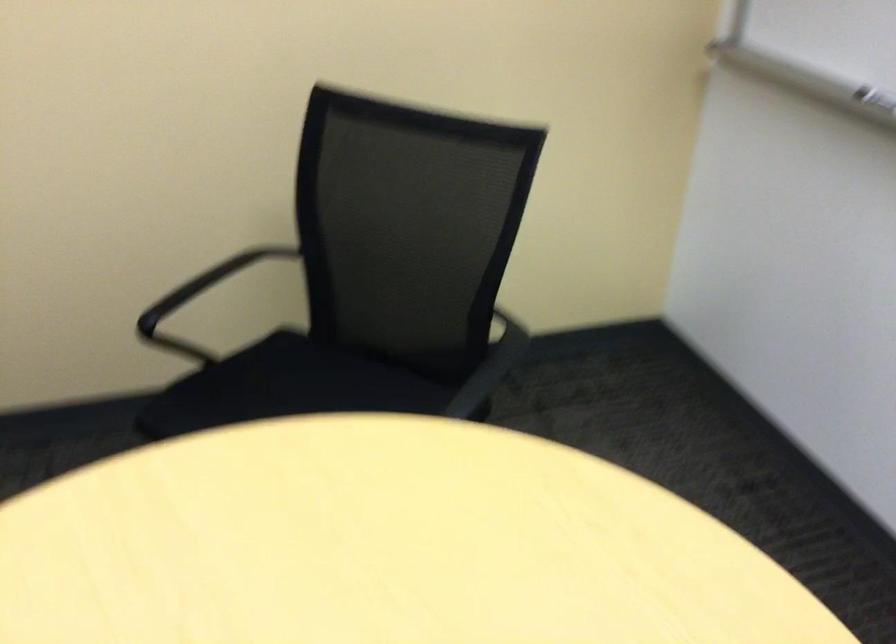
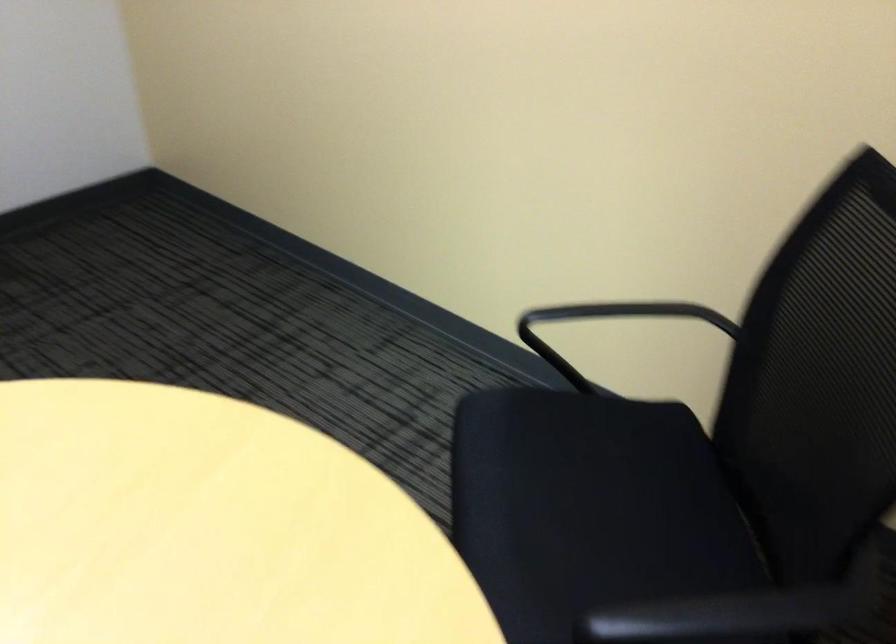
Question: The first image is from the beginning of the video and the second image is from the end. How did the camera likely rotate when shooting the video?

Choices:
 (A) Left
 (B) Right
 (C) Up
 (D) Down

Answer: (A)